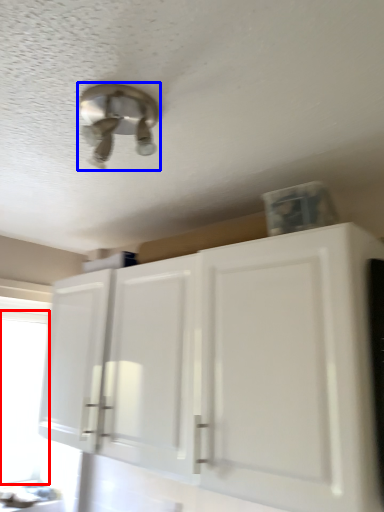
Question: Which object is further to the camera taking this photo, window screen (highlighted by a red box) or light fixture (highlighted by a blue box)?

Choices:
 (A) window screen
 (B) light fixture

Answer: (A)